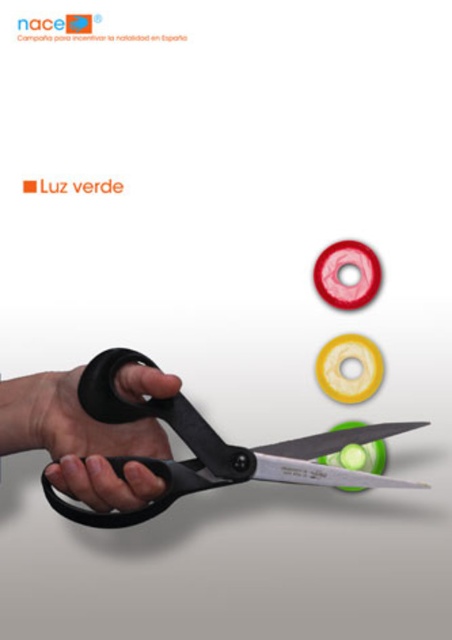
You are an artist preparing to cut a piece of fabric. You have two pairs of scissors in front of you, the black plastic scissors at center and the black matte scissors at center. Which pair is taller?

The black plastic scissors at center is much taller than the black matte scissors at center.

You are a person with a 30 cm long ruler. You want to measure the distance between yourself and the black plastic scissors at center. Can you reach it with your ruler?

The black plastic scissors at center is 30.67 centimeters away from the viewer. Since your ruler is 30 cm long, it is slightly shorter than the required distance. You cannot fully reach the scissors with your ruler.

You are a robot trying to determine the correct order of two points in the image. According to their positions, which point is closer to you, point (188,426) or point (69,417)?

Point (188,426) is in front of point (69,417), so it is closer to you.